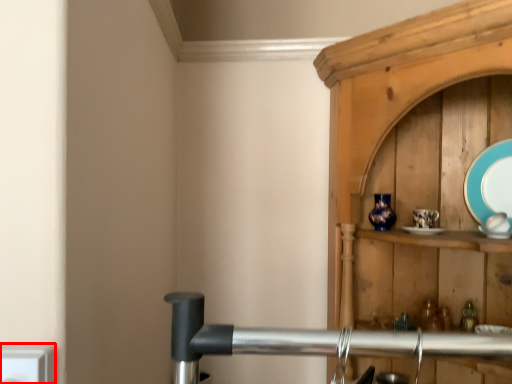
Question: In this image, where is electric outlet (annotated by the red box) located relative to platter?

Choices:
 (A) left
 (B) right

Answer: (A)